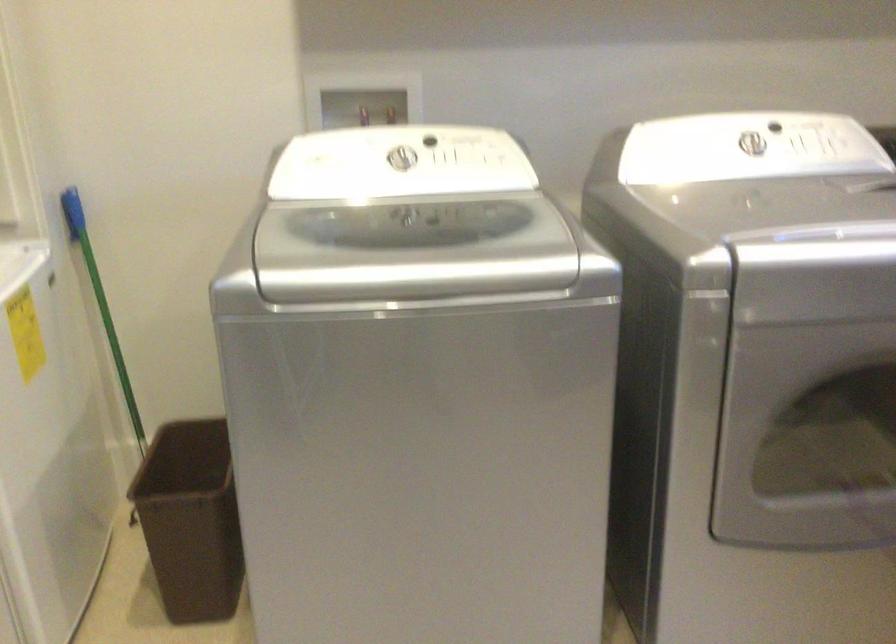
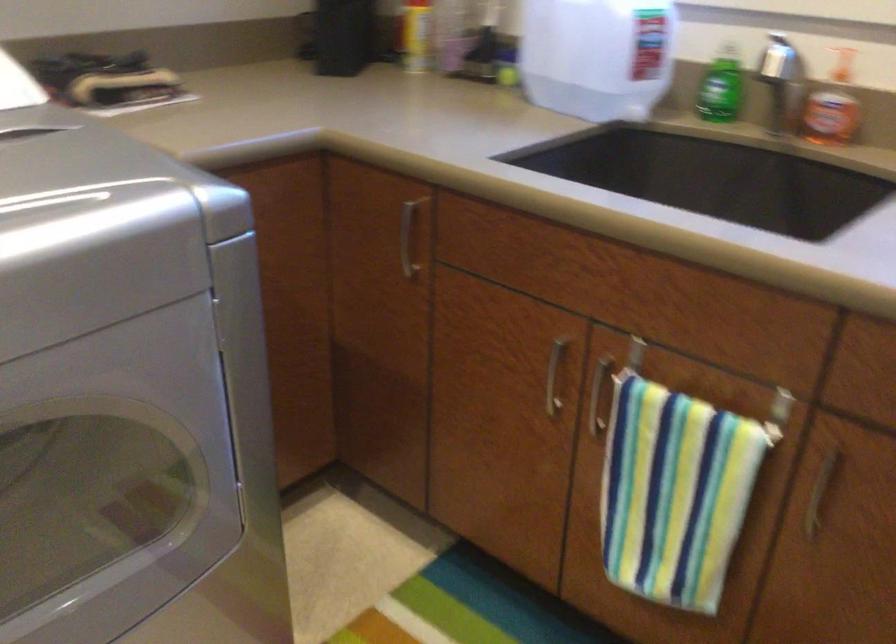
Question: The camera is either moving clockwise (left) or counter-clockwise (right) around the object. The first image is from the beginning of the video and the second image is from the end. Is the camera moving left or right when shooting the video?

Choices:
 (A) Left
 (B) Right

Answer: (A)